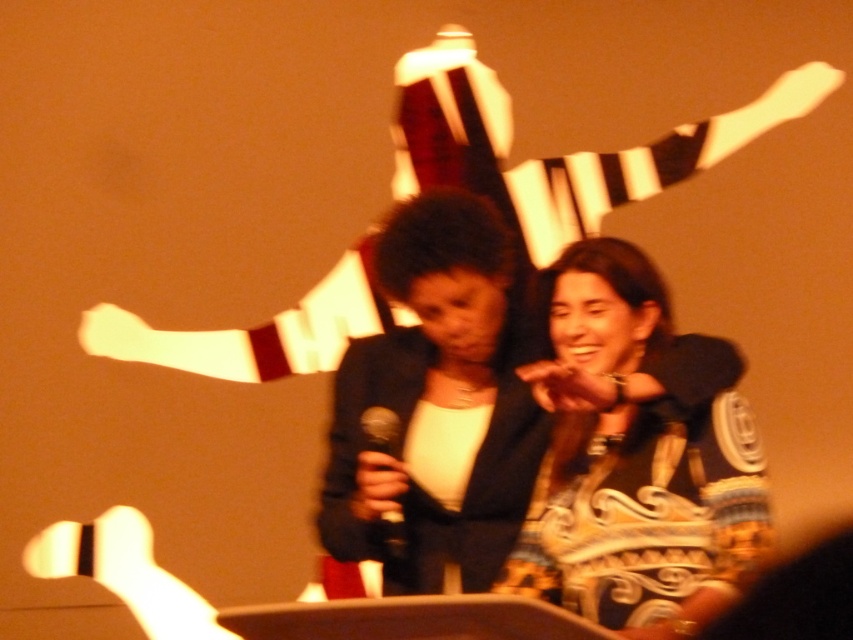
Which is below, matte black jacket at center or black matte microphone at center?

black matte microphone at center

The width and height of the screenshot is (853, 640). Describe the element at coordinates (637, 456) in the screenshot. I see `matte black jacket at center` at that location.

Where is `matte black jacket at center`? This screenshot has height=640, width=853. matte black jacket at center is located at coordinates (637, 456).

Looking at this image, can you confirm if matte black blazer at center is positioned above black matte microphone at center?

Correct, matte black blazer at center is located above black matte microphone at center.

Can you confirm if matte black blazer at center is thinner than black matte microphone at center?

Incorrect, matte black blazer at center's width is not less than black matte microphone at center's.

Which is behind, point (428, 509) or point (387, 552)?

The point (428, 509) is behind.

Identify the location of matte black blazer at center. This screenshot has height=640, width=853. (434, 406).

Does matte black jacket at center lie behind matte black blazer at center?

That is False.

Is point (647, 314) closer to viewer compared to point (408, 444)?

Yes, it is.

The width and height of the screenshot is (853, 640). What are the coordinates of `matte black jacket at center` in the screenshot? It's located at (637, 456).